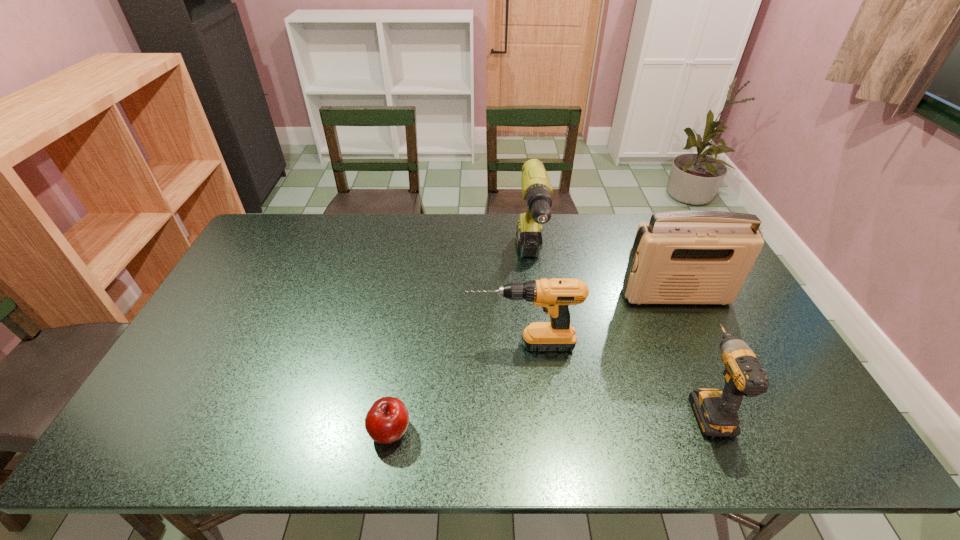
Where is `free space at the near edge of the desktop`? The width and height of the screenshot is (960, 540). free space at the near edge of the desktop is located at coordinates (220, 433).

In the image, there is a desktop. At what (x,y) coordinates should I click in order to perform the action: click on vacant space at the left edge. Please return your answer as a coordinate pair (x, y). This screenshot has height=540, width=960. Looking at the image, I should click on (178, 388).

Where is `free space at the near right corner of the desktop`? Image resolution: width=960 pixels, height=540 pixels. free space at the near right corner of the desktop is located at coordinates (776, 428).

The width and height of the screenshot is (960, 540). Identify the location of free space between the rightmost drill and the radio receiver. (x=691, y=351).

Where is `free space between the second nearest drill and the radio receiver`? free space between the second nearest drill and the radio receiver is located at coordinates (599, 320).

The width and height of the screenshot is (960, 540). Identify the location of empty location between the radio receiver and the farthest drill. (603, 279).

Where is `free space that is in between the shortest object and the nearest drill`? The width and height of the screenshot is (960, 540). free space that is in between the shortest object and the nearest drill is located at coordinates (548, 418).

Locate an element on the screen. The width and height of the screenshot is (960, 540). blank region between the third farthest object and the farthest drill is located at coordinates (526, 304).

Identify the location of blank region between the radio receiver and the shortest object. The height and width of the screenshot is (540, 960). (533, 363).

What are the coordinates of `free space between the rightmost drill and the leftmost object` in the screenshot? It's located at (548, 418).